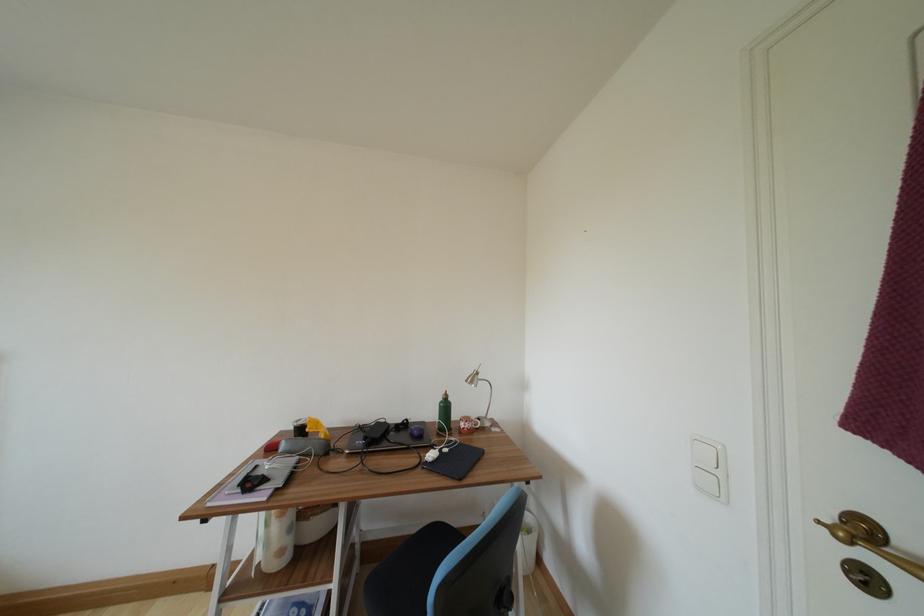
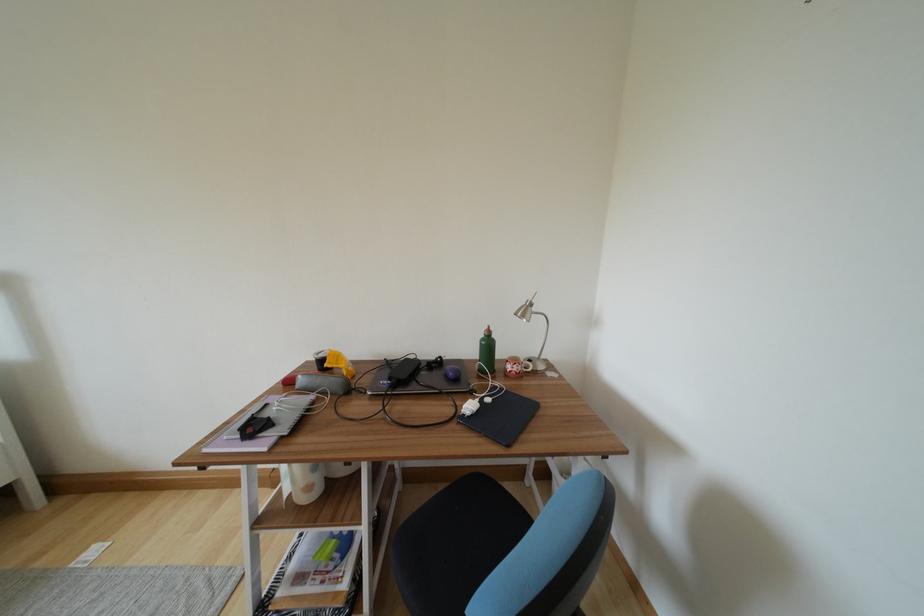
Locate, in the second image, the point that corresponds to pixel 477 386 in the first image.

(528, 320)